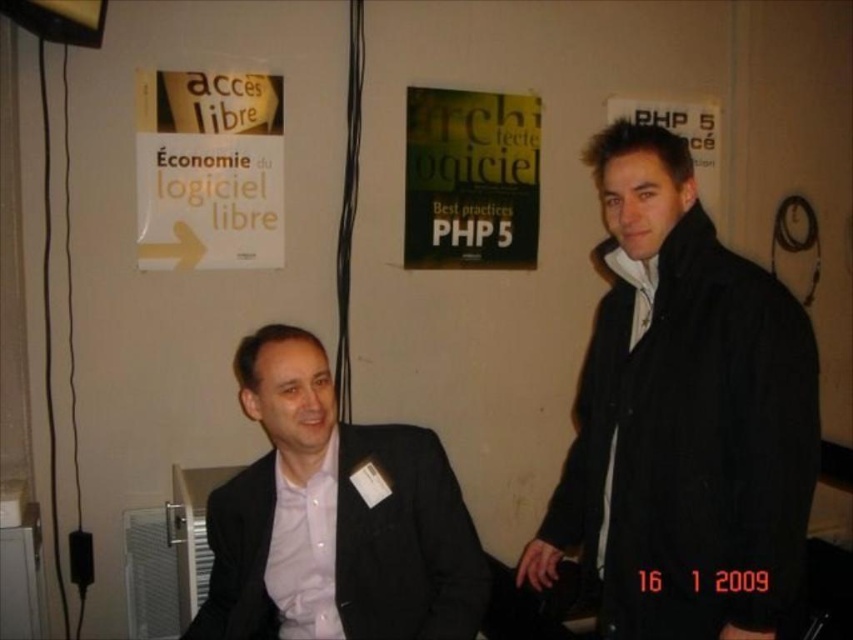
Image resolution: width=853 pixels, height=640 pixels. What do you see at coordinates (209, 170) in the screenshot?
I see `white paper poster at upper left` at bounding box center [209, 170].

Between white paper poster at upper left and matte black php 5 poster at upper right, which one has less height?

With less height is matte black php 5 poster at upper right.

Is point (245, 74) more distant than point (698, 173)?

No, (245, 74) is closer to viewer.

At what (x,y) coordinates should I click in order to perform the action: click on white paper poster at upper left. Please return your answer as a coordinate pair (x, y). This screenshot has width=853, height=640. Looking at the image, I should click on (209, 170).

Who is lower down, black matte suit at left or matte black php 5 poster at upper right?

Result: black matte suit at left

Which is behind, point (299, 509) or point (691, 145)?

The point (691, 145) is behind.

What are the coordinates of `black matte suit at left` in the screenshot? It's located at (334, 518).

Which of these two, white paper poster at upper left or green matte book at center, stands shorter?

white paper poster at upper left is shorter.

Does white paper poster at upper left come behind green matte book at center?

No, white paper poster at upper left is in front of green matte book at center.

Does point (244, 253) come behind point (447, 208)?

No.

Where is `white paper poster at upper left`? The image size is (853, 640). white paper poster at upper left is located at coordinates (209, 170).